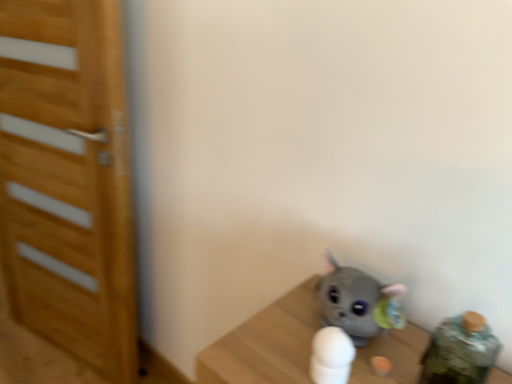
Question: From the image's perspective, is wooden door at left located beneath white matte toy at center?

Choices:
 (A) no
 (B) yes

Answer: (A)

Question: From the image's perspective, is wooden door at left above white matte toy at center?

Choices:
 (A) yes
 (B) no

Answer: (A)

Question: Is the position of wooden door at left more distant than that of white matte toy at center?

Choices:
 (A) no
 (B) yes

Answer: (B)

Question: From a real-world perspective, is wooden door at left on top of white matte toy at center?

Choices:
 (A) yes
 (B) no

Answer: (B)

Question: Could white matte toy at center be considered to be inside wooden door at left?

Choices:
 (A) yes
 (B) no

Answer: (B)

Question: Is wooden door at left placed right next to white matte toy at center?

Choices:
 (A) yes
 (B) no

Answer: (B)

Question: Is white matte toy at center facing away from wooden door at left?

Choices:
 (A) no
 (B) yes

Answer: (A)

Question: Is white matte toy at center thinner than wooden door at left?

Choices:
 (A) yes
 (B) no

Answer: (A)

Question: Can you confirm if white matte toy at center is wider than wooden door at left?

Choices:
 (A) no
 (B) yes

Answer: (A)

Question: From the image's perspective, is white matte toy at center on wooden door at left?

Choices:
 (A) yes
 (B) no

Answer: (B)

Question: Can you confirm if white matte toy at center is positioned to the right of wooden door at left?

Choices:
 (A) no
 (B) yes

Answer: (B)

Question: Is the depth of white matte toy at center less than that of wooden door at left?

Choices:
 (A) yes
 (B) no

Answer: (A)

Question: Is point (x=45, y=104) closer or farther from the camera than point (x=342, y=367)?

Choices:
 (A) closer
 (B) farther

Answer: (B)